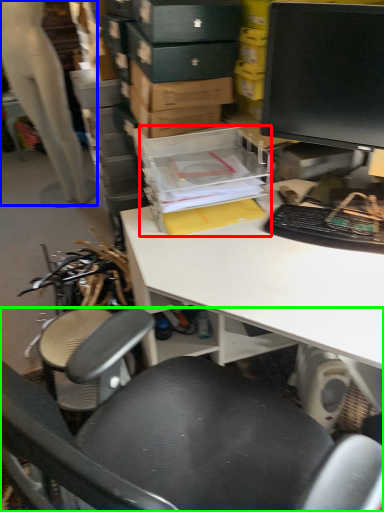
Question: Considering the real-world distances, which object is closest to storage box (highlighted by a red box)? person (highlighted by a blue box) or chair (highlighted by a green box).

Choices:
 (A) person
 (B) chair

Answer: (B)